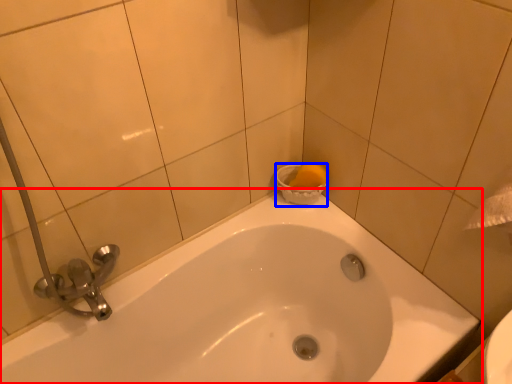
Question: Which of the following is the closest to the observer, bathtub (highlighted by a red box) or basin (highlighted by a blue box)?

Choices:
 (A) bathtub
 (B) basin

Answer: (A)